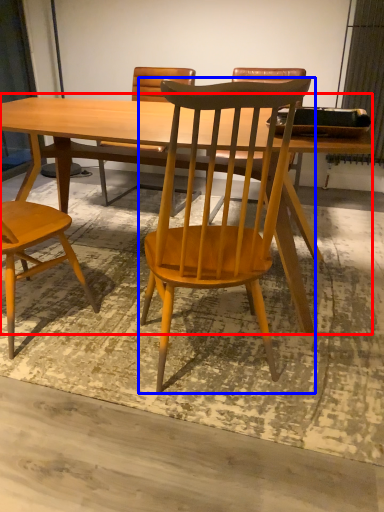
Question: Among these objects, which one is farthest to the camera, table (highlighted by a red box) or chair (highlighted by a blue box)?

Choices:
 (A) table
 (B) chair

Answer: (A)